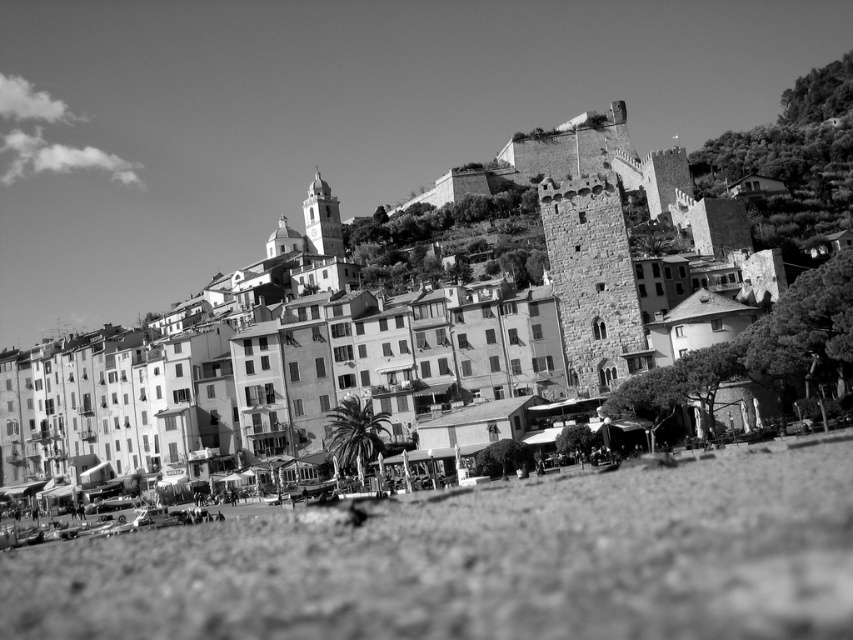
You are standing at the center of the image. Which direction should you move to reach the gravelly sand at lower center?

You should move downward and toward the center to reach the gravelly sand at lower center, as it is located at point coordinates of 0.881 on the x axis and 0.565 on the y axis.

You are a tourist standing on the gravelly sand at lower center and want to take a photo of the smooth stone tower at upper center. Will the tower be fully visible in your photo if you stand where you are?

The smooth stone tower at upper center is taller than the gravelly sand at lower center, so yes, the tower will be fully visible in your photo from your current position.